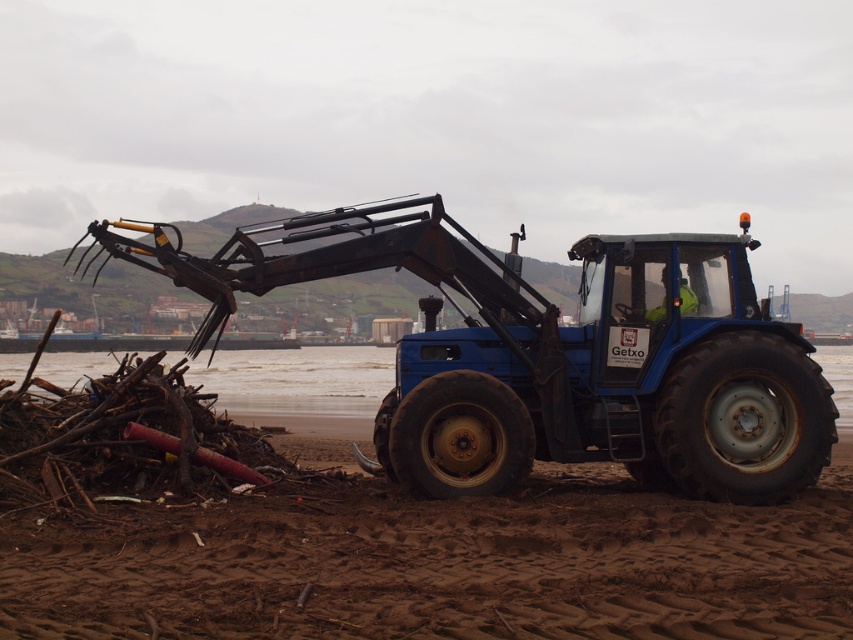
In the scene shown: Between brown sandy beach at lower center and blue matte tractor at center, which one appears on the left side from the viewer's perspective?

brown sandy beach at lower center is more to the left.

Is point (618, 564) positioned in front of point (770, 413)?

Yes, it is.

You are a GUI agent. You are given a task and a screenshot of the screen. Output one action in this format:
    pyautogui.click(x=<x>, y=<y>)
    Task: Click on the brown sandy beach at lower center
    Image resolution: width=853 pixels, height=640 pixels.
    Given the screenshot: What is the action you would take?
    pyautogui.click(x=438, y=563)